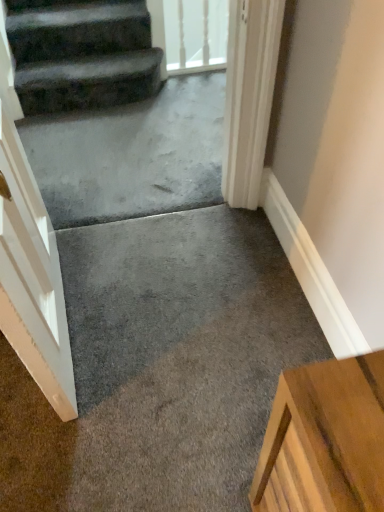
This screenshot has height=512, width=384. I want to click on gray concrete at center, so click(131, 155).

You are a GUI agent. You are given a task and a screenshot of the screen. Output one action in this format:
    pyautogui.click(x=<x>, y=<y>)
    Task: Click on the gray concrete at center
    Image resolution: width=384 pixels, height=512 pixels.
    Given the screenshot: What is the action you would take?
    pyautogui.click(x=131, y=155)

Is transparent glass door at upper center turned away from dark gray carpeted stairs at upper left?

No, transparent glass door at upper center's orientation is not away from dark gray carpeted stairs at upper left.

Is transparent glass door at upper center thinner than dark gray carpeted stairs at upper left?

Correct, the width of transparent glass door at upper center is less than that of dark gray carpeted stairs at upper left.

Based on the photo, considering the sizes of objects transparent glass door at upper center and dark gray carpeted stairs at upper left in the image provided, who is taller, transparent glass door at upper center or dark gray carpeted stairs at upper left?

transparent glass door at upper center is taller.

Measure the distance from transparent glass door at upper center to dark gray carpeted stairs at upper left.

The distance of transparent glass door at upper center from dark gray carpeted stairs at upper left is 6.50 feet.

From the picture: Is dark gray carpeted stairs at upper left positioned before transparent glass door at upper center?

Yes, it is.

Would you consider dark gray carpeted stairs at upper left to be distant from transparent glass door at upper center?

Yes, dark gray carpeted stairs at upper left is far from transparent glass door at upper center.

Does dark gray carpeted stairs at upper left appear on the right side of transparent glass door at upper center?

Incorrect, dark gray carpeted stairs at upper left is not on the right side of transparent glass door at upper center.

Measure the distance from dark gray carpeted stairs at upper left to transparent glass door at upper center.

They are 6.50 feet apart.

Is gray concrete at center bigger or smaller than transparent glass door at upper center?

Clearly, gray concrete at center is larger in size than transparent glass door at upper center.

Can you confirm if gray concrete at center is positioned to the right of transparent glass door at upper center?

No, gray concrete at center is not to the right of transparent glass door at upper center.

From the picture: Is transparent glass door at upper center a part of gray concrete at center?

No, transparent glass door at upper center is located outside of gray concrete at center.

Is gray concrete at center positioned far away from transparent glass door at upper center?

That's right, there is a large distance between gray concrete at center and transparent glass door at upper center.

Can you confirm if transparent glass door at upper center is thinner than gray concrete at center?

Yes, transparent glass door at upper center is thinner than gray concrete at center.

Is transparent glass door at upper center bigger or smaller than gray concrete at center?

Clearly, transparent glass door at upper center is smaller in size than gray concrete at center.

Find the location of `concrete below the transparent glass door at upper center (from a real-world perspective)`. concrete below the transparent glass door at upper center (from a real-world perspective) is located at coordinates (131, 155).

Considering the sizes of transparent glass door at upper center and gray concrete at center in the image, is transparent glass door at upper center taller or shorter than gray concrete at center?

In the image, transparent glass door at upper center appears to be taller than gray concrete at center.

Is dark gray carpeted stairs at upper left facing away from gray concrete at center?

No.

Can you confirm if dark gray carpeted stairs at upper left is smaller than gray concrete at center?

Correct, dark gray carpeted stairs at upper left occupies less space than gray concrete at center.

Considering the positions of point (159, 82) and point (131, 212), is point (159, 82) closer or farther from the camera than point (131, 212)?

Clearly, point (159, 82) is more distant from the camera than point (131, 212).

Does dark gray carpeted stairs at upper left appear on the right side of gray concrete at center?

In fact, dark gray carpeted stairs at upper left is to the left of gray concrete at center.

From the image's perspective, is gray concrete at center below dark gray carpeted stairs at upper left?

Yes, from the image's perspective, gray concrete at center is below dark gray carpeted stairs at upper left.

Visually, is gray concrete at center positioned to the left or to the right of dark gray carpeted stairs at upper left?

gray concrete at center is to the right of dark gray carpeted stairs at upper left.

Consider the image. Considering the relative sizes of gray concrete at center and dark gray carpeted stairs at upper left in the image provided, is gray concrete at center bigger than dark gray carpeted stairs at upper left?

Yes, gray concrete at center is bigger than dark gray carpeted stairs at upper left.

Find the location of a particular element. This screenshot has height=512, width=384. glass door behind the dark gray carpeted stairs at upper left is located at coordinates (195, 35).

Image resolution: width=384 pixels, height=512 pixels. I want to click on stairs on the left side of transparent glass door at upper center, so click(x=81, y=54).

Estimate the real-world distances between objects in this image. Which object is further from transparent glass door at upper center, gray concrete at center or dark gray carpeted stairs at upper left?

Based on the image, gray concrete at center appears to be further to transparent glass door at upper center.

When comparing their distances from gray concrete at center, does dark gray carpeted stairs at upper left or transparent glass door at upper center seem further?

Among the two, transparent glass door at upper center is located further to gray concrete at center.

Looking at the image, which one is located further to dark gray carpeted stairs at upper left, transparent glass door at upper center or gray concrete at center?

The object further to dark gray carpeted stairs at upper left is transparent glass door at upper center.

When comparing their distances from transparent glass door at upper center, does dark gray carpeted stairs at upper left or gray concrete at center seem closer?

Based on the image, dark gray carpeted stairs at upper left appears to be nearer to transparent glass door at upper center.

Estimate the real-world distances between objects in this image. Which object is further from gray concrete at center, transparent glass door at upper center or dark gray carpeted stairs at upper left?

transparent glass door at upper center is positioned further to the anchor gray concrete at center.

Which object lies further to the anchor point dark gray carpeted stairs at upper left, gray concrete at center or transparent glass door at upper center?

Among the two, transparent glass door at upper center is located further to dark gray carpeted stairs at upper left.

Where is `stairs between transparent glass door at upper center and gray concrete at center from top to bottom`? This screenshot has width=384, height=512. stairs between transparent glass door at upper center and gray concrete at center from top to bottom is located at coordinates (81, 54).